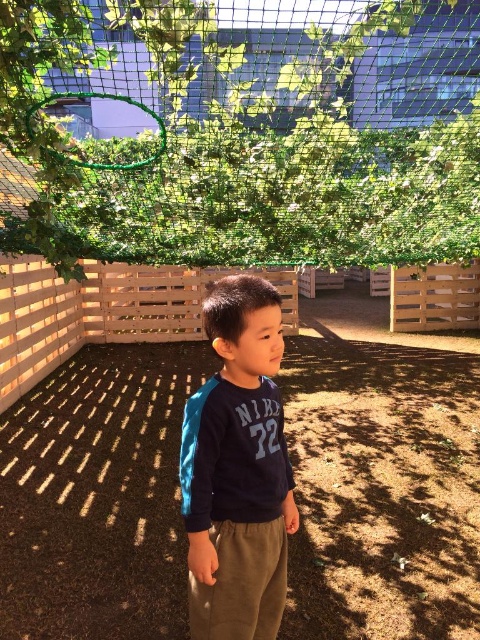
Question: Which of the following is the farthest from the observer?

Choices:
 (A) (84, 156)
 (B) (184, 305)
 (C) (264, 504)

Answer: (B)

Question: Among these points, which one is farthest from the camera?

Choices:
 (A) [x=37, y=291]
 (B) [x=91, y=172]

Answer: (A)

Question: From the image, what is the correct spatial relationship of green mesh netting at upper center in relation to navy blue sweatshirt at center?

Choices:
 (A) left
 (B) right

Answer: (A)

Question: Which point is closer to the camera?

Choices:
 (A) green mesh netting at upper center
 (B) wooden fence at center
 (C) navy blue sweatshirt at center

Answer: (C)

Question: Is navy blue sweatshirt at center above wooden fence at center?

Choices:
 (A) no
 (B) yes

Answer: (A)

Question: Is green mesh netting at upper center wider than navy blue sweatshirt at center?

Choices:
 (A) no
 (B) yes

Answer: (B)